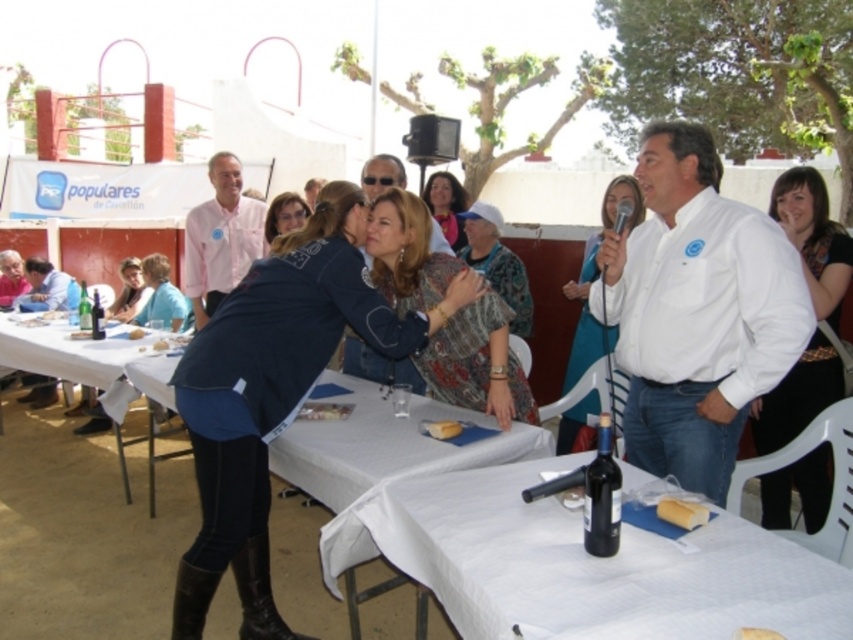
Who is shorter, white cloth at lower left or translucent glass bottle at center?

With less height is translucent glass bottle at center.

How far apart are white cloth at lower left and translucent glass bottle at center?

white cloth at lower left and translucent glass bottle at center are 61.78 centimeters apart from each other.

Between point (117, 364) and point (82, 323), which one is positioned in front?

Point (117, 364)

Identify the location of white cloth at lower left. (77, 365).

From the picture: How much distance is there between dark blue leather jacket at center and white cloth at lower left?

dark blue leather jacket at center is 2.13 meters from white cloth at lower left.

The image size is (853, 640). Describe the element at coordinates (274, 392) in the screenshot. I see `dark blue leather jacket at center` at that location.

Who is more forward, (264, 547) or (126, 484)?

Point (264, 547)

Locate an element on the screen. The image size is (853, 640). dark blue leather jacket at center is located at coordinates (274, 392).

The width and height of the screenshot is (853, 640). Find the location of `white bread at lower center`. white bread at lower center is located at coordinates (682, 513).

Is point (680, 515) positioned after point (757, 628)?

Yes, point (680, 515) is behind point (757, 628).

Find the location of a particular element. This screenshot has width=853, height=640. white bread at lower center is located at coordinates (682, 513).